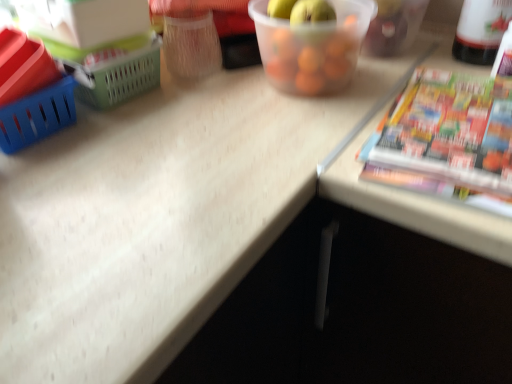
Image resolution: width=512 pixels, height=384 pixels. I want to click on free point above multicolored glossy paperback book at right (from a real-world perspective), so click(458, 115).